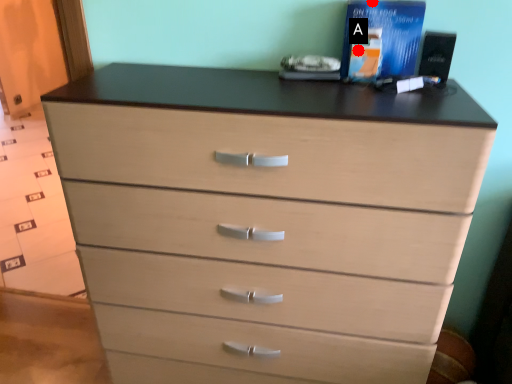
Question: Two points are circled on the image, labeled by A and B beside each circle. Which of the following is the closest to the observer?

Choices:
 (A) A is closer
 (B) B is closer

Answer: (B)